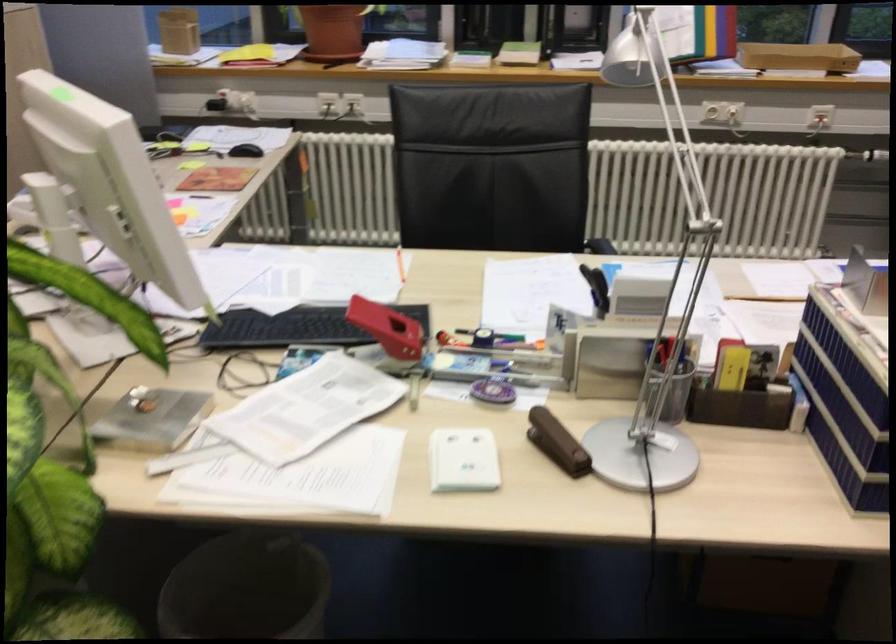
This screenshot has width=896, height=644. I want to click on black computer mouse, so click(x=245, y=151).